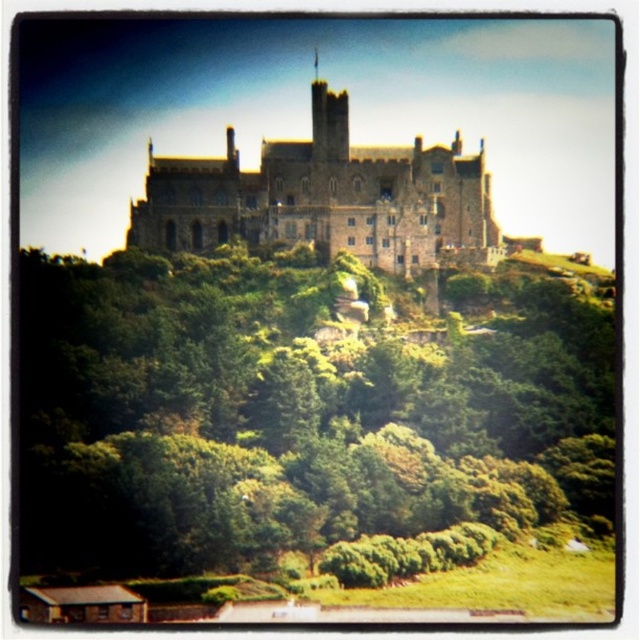
You are a visitor standing at the base of the hill looking up at the green leafy tree at upper center and the brown stone castle at center. Which object is closer to your left side?

The green leafy tree at upper center is positioned on the left side of brown stone castle at center, so from your perspective at the base of the hill, the green leafy tree at upper center is closer to your left side.

In the scene shown: You are a visitor standing at the base of the hill looking up at the castle. You notice a green leafy tree at upper center and a brown stone castle at center. Which object is positioned higher in the image?

The brown stone castle at center is positioned higher than the green leafy tree at upper center.

You are a painter standing at the base of the hill, looking up at the green leafy tree at upper center and the brown stone castle at center. Which object appears wider from your perspective?

The green leafy tree at upper center appears wider than the brown stone castle at center because its width surpasses the castle.